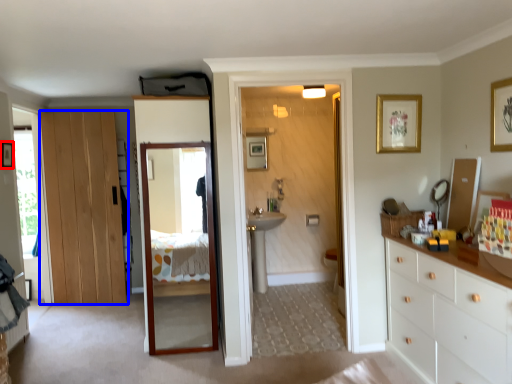
Question: Which point is further to the camera, picture frame (highlighted by a red box) or door (highlighted by a blue box)?

Choices:
 (A) picture frame
 (B) door

Answer: (B)